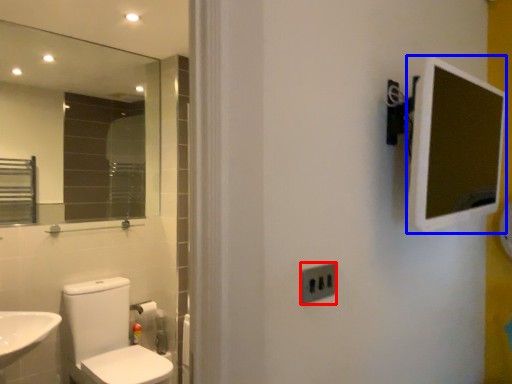
Question: Among these objects, which one is farthest to the camera, electric outlet (highlighted by a red box) or medicine cabinet (highlighted by a blue box)?

Choices:
 (A) electric outlet
 (B) medicine cabinet

Answer: (A)